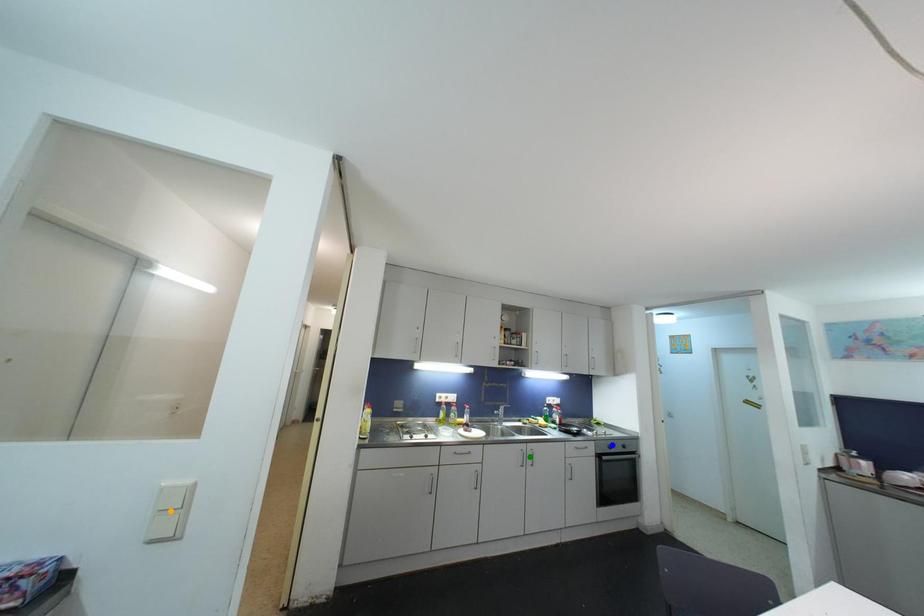
Order these from nearest to farthest:
blue point
green point
orange point

1. orange point
2. green point
3. blue point